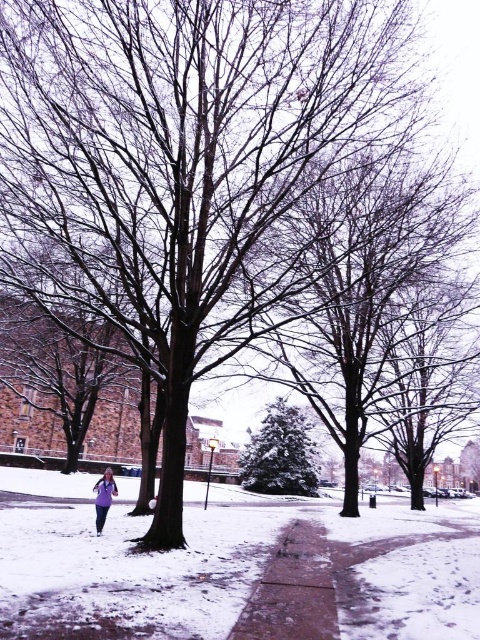
Question: Which point is closer to the camera?

Choices:
 (A) concrete sidewalk at center
 (B) purple matte jacket at lower left

Answer: (A)

Question: Can you confirm if green textured evergreen tree at center is positioned above purple matte jacket at lower left?

Choices:
 (A) yes
 (B) no

Answer: (B)

Question: Which point is farther from the camera taking this photo?

Choices:
 (A) [x=142, y=618]
 (B) [x=263, y=460]
 (C) [x=95, y=490]
 (D) [x=320, y=632]

Answer: (B)

Question: Can you confirm if concrete sidewalk at center is positioned above green textured evergreen tree at center?

Choices:
 (A) no
 (B) yes

Answer: (B)

Question: Among these objects, which one is nearest to the camera?

Choices:
 (A) concrete sidewalk at center
 (B) green textured evergreen tree at center
 (C) purple matte jacket at lower left
 (D) sandy concrete sidewalk at center

Answer: (D)

Question: Is sandy concrete sidewalk at center above purple matte jacket at lower left?

Choices:
 (A) no
 (B) yes

Answer: (A)